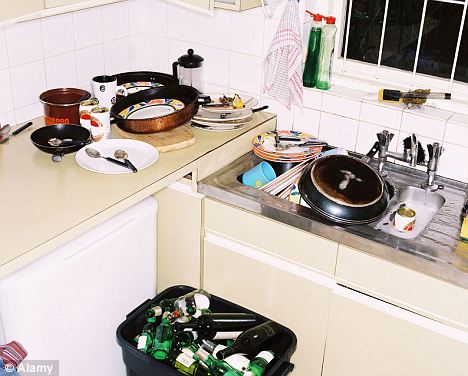
This screenshot has height=376, width=468. In order to click on window in this screenshot , I will do `click(438, 69)`.